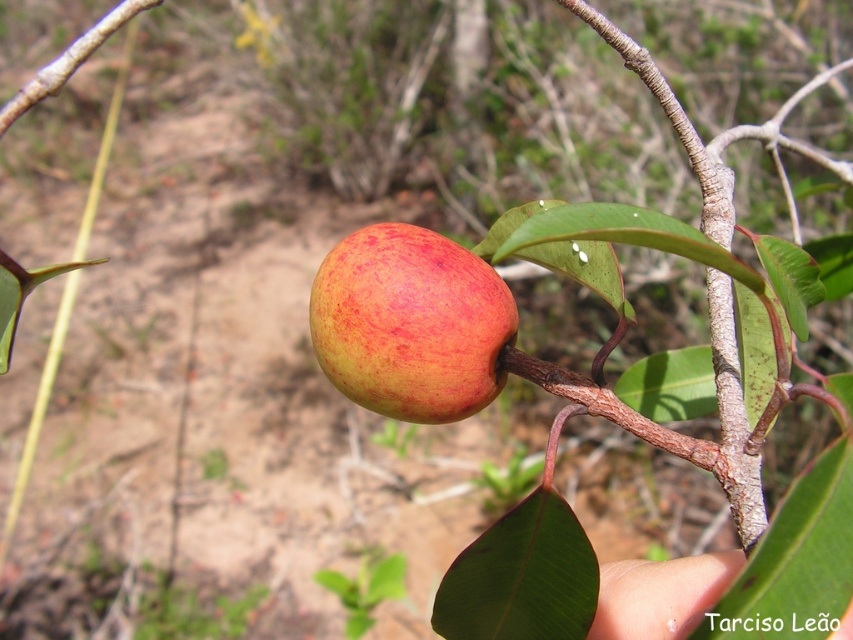
Question: Does ripe red apple at center have a smaller size compared to pale skin at lower right?

Choices:
 (A) yes
 (B) no

Answer: (B)

Question: Is ripe red apple at center bigger than pale skin at lower right?

Choices:
 (A) no
 (B) yes

Answer: (B)

Question: Can you confirm if ripe red apple at center is thinner than pale skin at lower right?

Choices:
 (A) yes
 (B) no

Answer: (B)